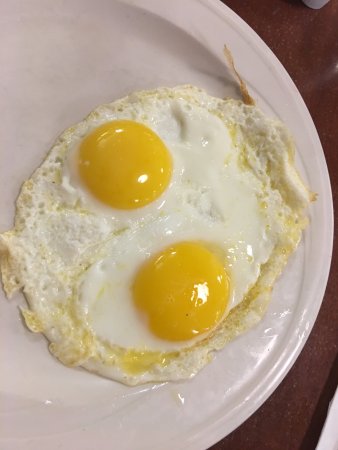
Where is `burgundy table`? The image size is (338, 450). burgundy table is located at coordinates (310, 57), (296, 410).